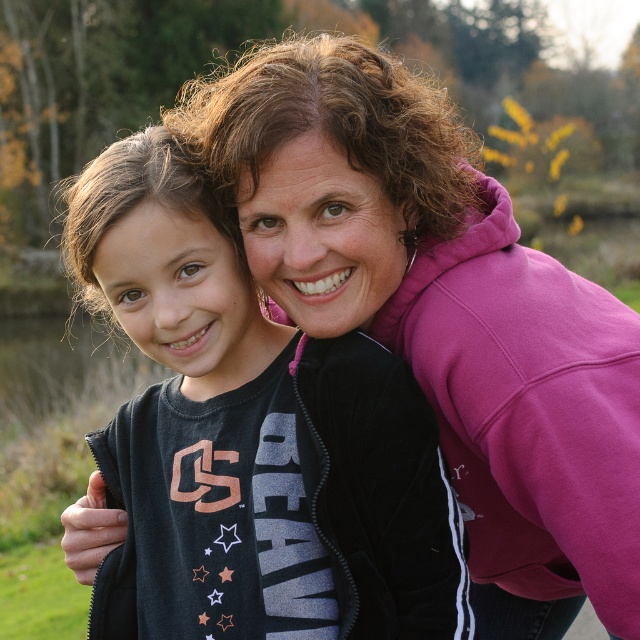
You are a photographer adjusting the focus on a camera. You want to capture both the pink fleece at upper right and the black matte jacket at center in sharp focus. The camera can focus on objects within a 12 inch range. Can both objects be in focus at the same time?

The pink fleece at upper right and black matte jacket at center are 15.02 inches apart from each other. Since the camera can only focus on objects within a 12 inch range, the distance between them exceeds the camera focus range. Therefore, both objects cannot be in focus simultaneously.

In the scene shown: You are a photographer trying to capture a portrait of the two people in the scene. You notice the pink fleece at upper right and the black matte jacket at center. Which clothing item should you adjust to ensure both subjects are in focus without changing your camera settings?

The pink fleece at upper right is much taller than the black matte jacket at center. To ensure both subjects are in focus, you should lower the pink fleece at upper right so that it aligns with the height of the black matte jacket at center, thereby reducing the depth of field required.